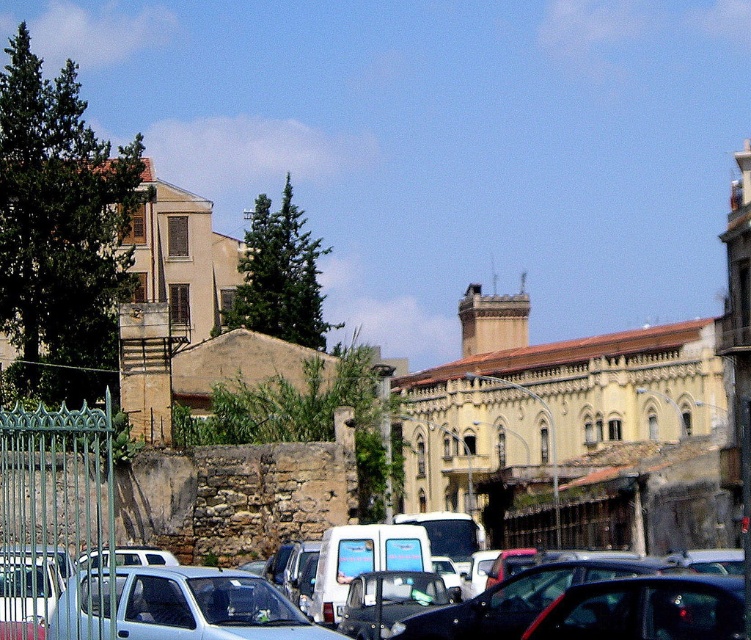
Who is more distant from viewer, (92, 456) or (116, 596)?

The point (92, 456) is behind.

Is the position of green wrought iron fence at left more distant than that of light blue matte car at center?

No.

Is point (5, 541) positioned behind point (294, 632)?

Yes, point (5, 541) is behind point (294, 632).

Identify the location of green wrought iron fence at left. (56, 524).

Who is higher up, metallic silver car at center or green wrought iron fence at left?

green wrought iron fence at left is above.

Does metallic silver car at center have a greater width compared to green wrought iron fence at left?

Yes, metallic silver car at center is wider than green wrought iron fence at left.

I want to click on metallic silver car at center, so click(x=584, y=604).

Where is `metallic silver car at center`? The height and width of the screenshot is (640, 751). metallic silver car at center is located at coordinates (584, 604).

Is metallic silver car at center below light blue matte car at center?

Yes.

Is metallic silver car at center thinner than light blue matte car at center?

Incorrect, metallic silver car at center's width is not less than light blue matte car at center's.

Which is in front, point (95, 593) or point (164, 592)?

Point (164, 592)

Locate an element on the screen. The height and width of the screenshot is (640, 751). metallic silver car at center is located at coordinates (584, 604).